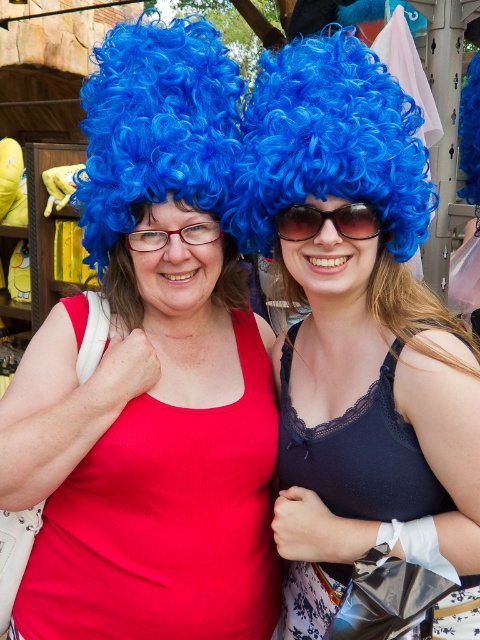
Can you confirm if matte blue wig at center is shorter than blue curly wig at upper center?

In fact, matte blue wig at center may be taller than blue curly wig at upper center.

Who is taller, matte blue wig at center or blue curly wig at upper center?

With more height is matte blue wig at center.

Between point (271, 596) and point (142, 202), which one is positioned behind?

Positioned behind is point (271, 596).

Identify the location of matte blue wig at center. The height and width of the screenshot is (640, 480). (151, 378).

Describe the element at coordinates (151, 378) in the screenshot. This screenshot has height=640, width=480. I see `matte blue wig at center` at that location.

Can you confirm if matte blue wig at center is wider than blue curly wig at center?

Yes, matte blue wig at center is wider than blue curly wig at center.

Locate an element on the screen. The height and width of the screenshot is (640, 480). matte blue wig at center is located at coordinates (151, 378).

I want to click on matte blue wig at center, so click(151, 378).

Who is more forward, (12, 461) or (327, 490)?

Point (12, 461) is more forward.

Can you confirm if matte blue wig at center is positioned to the right of lace fabric dress at center?

No, matte blue wig at center is not to the right of lace fabric dress at center.

Does point (86, 166) come behind point (385, 496)?

Yes, it is.

The width and height of the screenshot is (480, 640). What are the coordinates of `matte blue wig at center` in the screenshot? It's located at (151, 378).